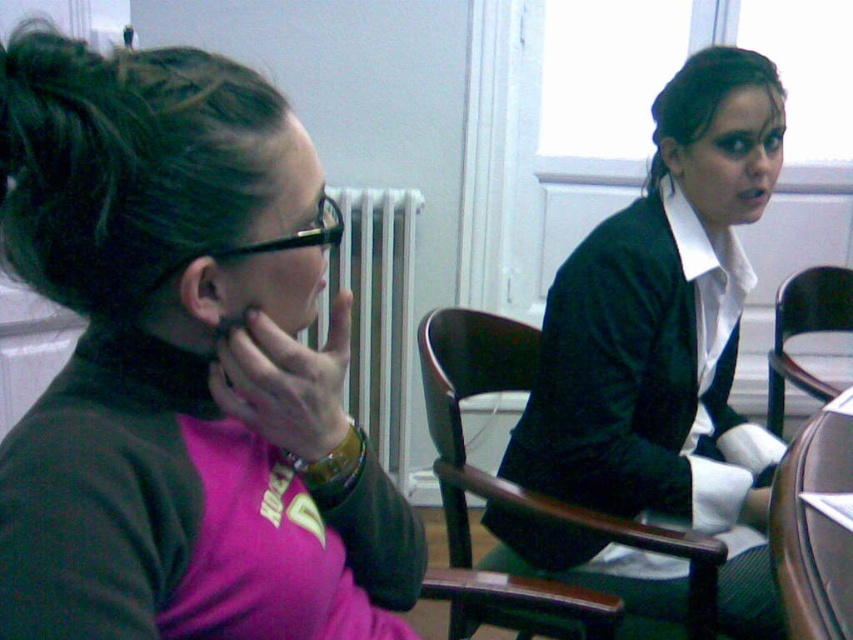
You are standing in the room and want to move from the white radiator at center to the black wood chair at right. Which object will you pass closer to as you walk towards the chair?

Since the white radiator at center is further to the viewer than the black wood chair at right, you will pass closer to the white radiator at center as you walk towards the chair.

Based on the photo, you are taking a photo of two people in a room. You notice two points in the image labeled as point [16,228] and point [815,580]. Which point is more likely to be in focus if you focus on the person closer to the camera?

Point [16,228] is closer to the camera than point [815,580], so it would be more likely to be in focus when focusing on the person closer to the camera.